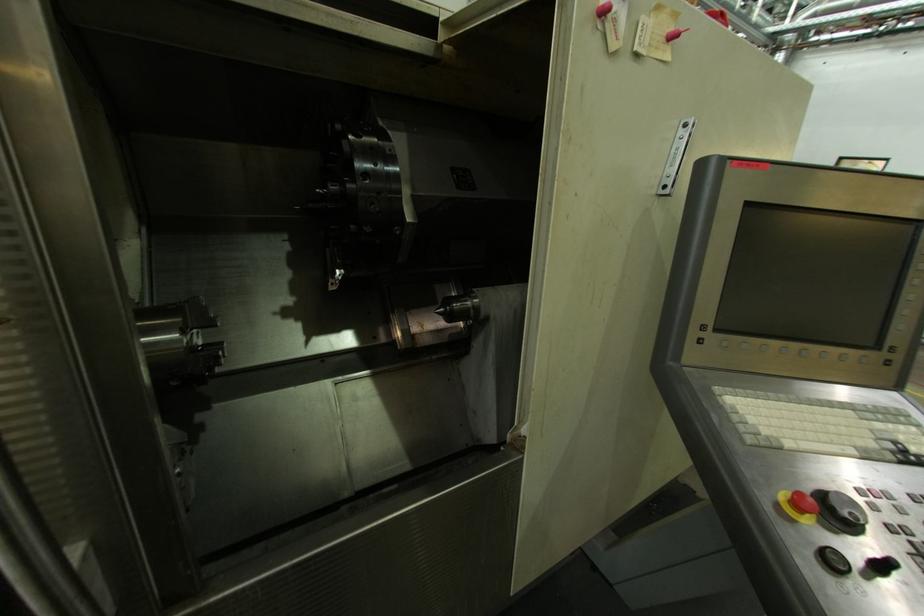
What do you see at coordinates (423, 329) in the screenshot?
I see `a silver metal handle` at bounding box center [423, 329].